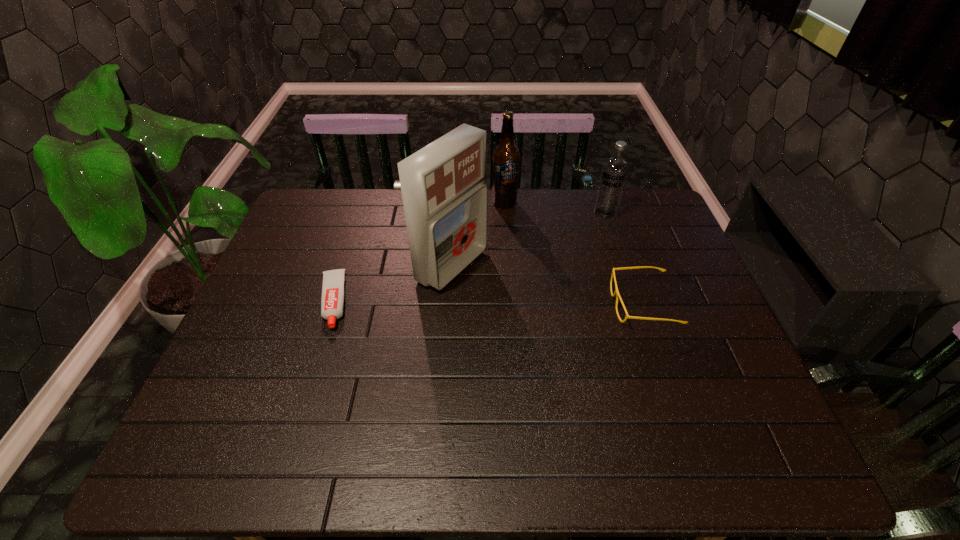
Locate an element on the screen. This screenshot has height=540, width=960. the leftmost object is located at coordinates (332, 301).

Locate an element on the screen. the shortest object is located at coordinates (332, 301).

Where is `the second shortest object`? the second shortest object is located at coordinates click(616, 293).

Where is `the third shortest object`? The width and height of the screenshot is (960, 540). the third shortest object is located at coordinates (615, 169).

The image size is (960, 540). I want to click on beer bottle, so click(506, 157).

Find the location of a particular element. the fourth shortest object is located at coordinates (506, 157).

Image resolution: width=960 pixels, height=540 pixels. Identify the location of the tallest object. (444, 194).

You are a GUI agent. You are given a task and a screenshot of the screen. Output one action in this format:
    pyautogui.click(x=<x>, y=<y>)
    Task: Click on the first-aid kit
    The image size is (960, 540).
    Given the screenshot: What is the action you would take?
    pyautogui.click(x=444, y=194)

Identify the location of free region located on the right of the shortest object. Image resolution: width=960 pixels, height=540 pixels. (x=379, y=301).

I want to click on free space located 0.090m in front of the lenses of the spectacles, so pos(579,304).